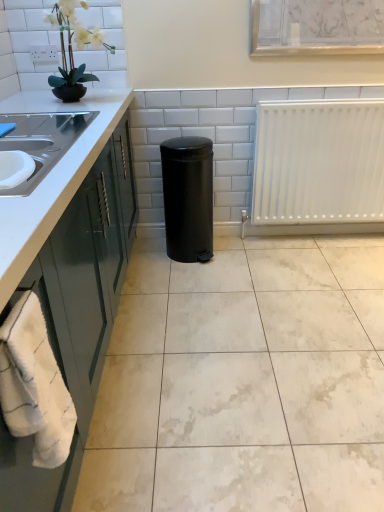
Find the location of a particular element. vacant space underneath matte black pot at upper left (from a real-world perspective) is located at coordinates (91, 102).